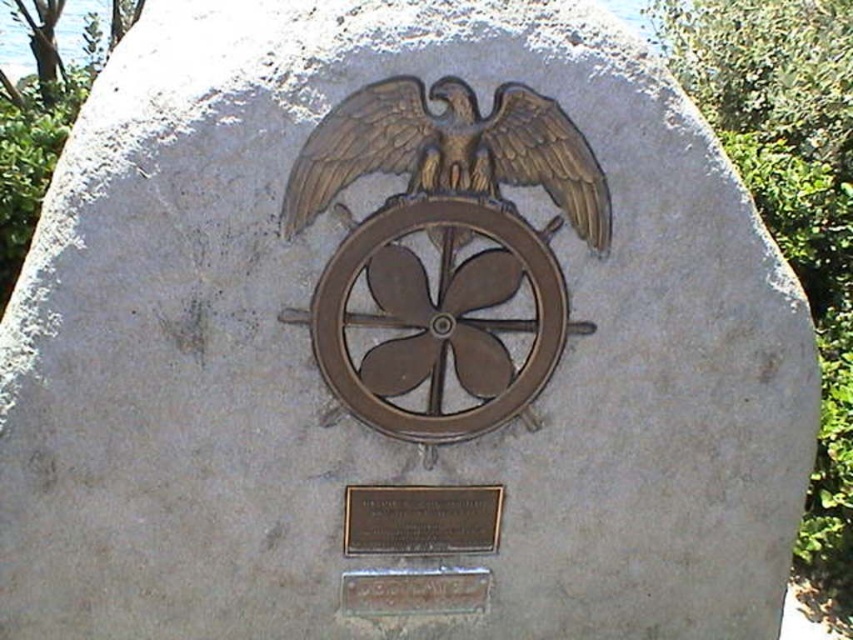
Between gold polished metal eagle at center and rusty metal plaque at lower center, which one is positioned lower?

rusty metal plaque at lower center

Based on the photo, which of these two, gold polished metal eagle at center or rusty metal plaque at lower center, stands shorter?

Standing shorter between the two is rusty metal plaque at lower center.

Does point (465, 86) lie in front of point (482, 589)?

Yes, point (465, 86) is closer to viewer.

I want to click on gold polished metal eagle at center, so click(x=450, y=150).

Does bronze/textured eagle at center appear over rusty metal plaque at lower center?

Indeed, bronze/textured eagle at center is positioned over rusty metal plaque at lower center.

This screenshot has height=640, width=853. What do you see at coordinates (444, 246) in the screenshot?
I see `bronze/textured eagle at center` at bounding box center [444, 246].

At what (x,y) coordinates should I click in order to perform the action: click on bronze/textured eagle at center. Please return your answer as a coordinate pair (x, y). The image size is (853, 640). Looking at the image, I should click on (444, 246).

Does bronze plaque at lower center come behind rusty metal plaque at lower center?

No, bronze plaque at lower center is in front of rusty metal plaque at lower center.

Can you confirm if bronze plaque at lower center is bigger than rusty metal plaque at lower center?

Yes.

Is point (392, 545) closer to camera compared to point (448, 593)?

Yes, point (392, 545) is closer to viewer.

The height and width of the screenshot is (640, 853). Find the location of `bronze plaque at lower center`. bronze plaque at lower center is located at coordinates (421, 518).